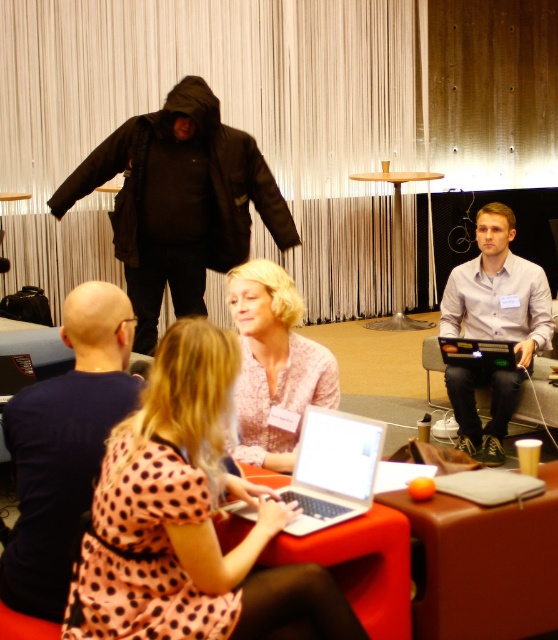
You are standing in the room depicted in the image and want to take a photo of the point at coordinates (279,301). The camera you are using has a maximum focus range of 2 meters. Will the camera be able to focus on the point?

The point at coordinates (279,301) is 2.24 meters away from the camera, which exceeds the camera maximum focus range of 2 meters. Therefore, the camera will not be able to focus on the point.